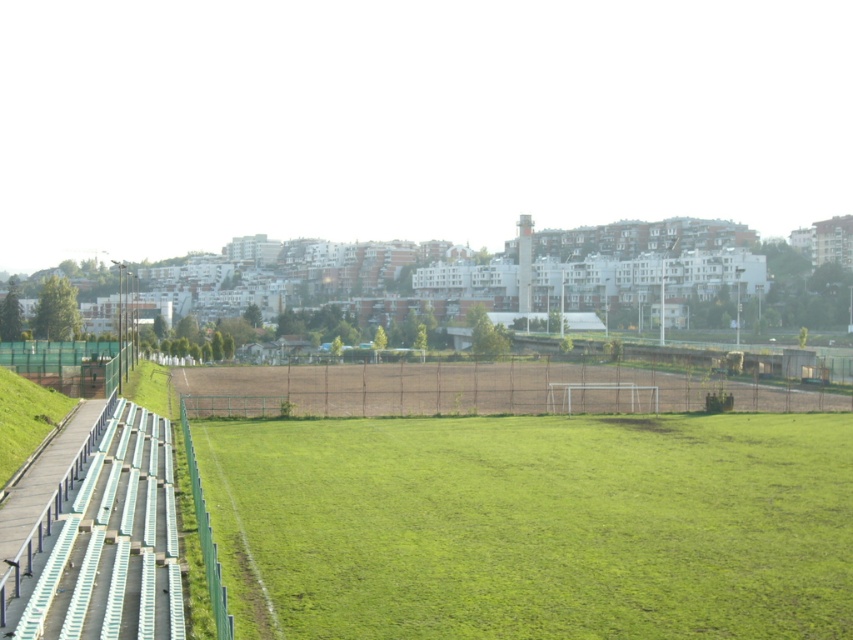
How much distance is there between brown mesh fence at center and green mesh fence at left?

brown mesh fence at center is 14.59 meters from green mesh fence at left.

Can you confirm if brown mesh fence at center is positioned to the right of green mesh fence at left?

Correct, you'll find brown mesh fence at center to the right of green mesh fence at left.

This screenshot has height=640, width=853. I want to click on brown mesh fence at center, so click(473, 388).

Is green grass field at center bigger than brown mesh fence at center?

Actually, green grass field at center might be smaller than brown mesh fence at center.

Does point (795, 573) come closer to viewer compared to point (509, 378)?

Yes, it is in front of point (509, 378).

Is point (839, 557) positioned after point (592, 369)?

No, it is in front of (592, 369).

Find the location of a particular element. green grass field at center is located at coordinates (534, 525).

Does green grass field at center have a lesser height compared to green mesh fence at left?

Indeed, green grass field at center has a lesser height compared to green mesh fence at left.

Can you confirm if green grass field at center is smaller than green mesh fence at left?

Correct, green grass field at center occupies less space than green mesh fence at left.

The width and height of the screenshot is (853, 640). What do you see at coordinates (534, 525) in the screenshot?
I see `green grass field at center` at bounding box center [534, 525].

I want to click on green grass field at center, so click(x=534, y=525).